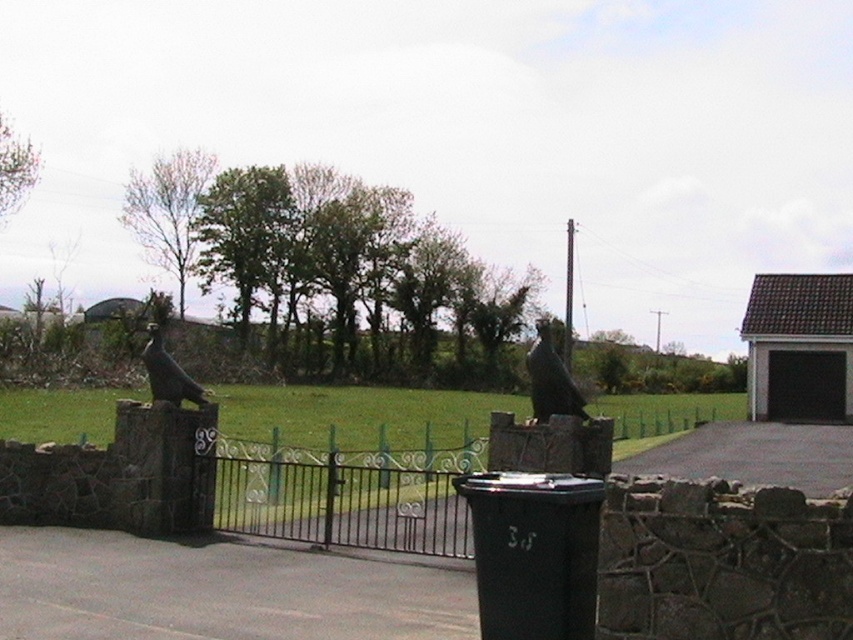
Which is in front, point (538, 413) or point (154, 365)?

Point (538, 413) is in front.

Is polished bronze eagle at center in front of matte black bird at left?

Yes.

Who is more distant from viewer, (529, 422) or (163, 385)?

Positioned behind is point (163, 385).

Locate an element on the screen. The width and height of the screenshot is (853, 640). polished bronze eagle at center is located at coordinates (550, 380).

Does black wrought iron gate at center come behind matte black bird at left?

No, it is in front of matte black bird at left.

Can you confirm if black wrought iron gate at center is smaller than matte black bird at left?

Yes.

Who is more distant from viewer, (x=440, y=550) or (x=170, y=401)?

The point (x=170, y=401) is behind.

Where is `black wrought iron gate at center`? The image size is (853, 640). black wrought iron gate at center is located at coordinates (347, 493).

Does black wrought iron gate at center appear on the right side of polished bronze eagle at center?

No, black wrought iron gate at center is not to the right of polished bronze eagle at center.

Consider the image. Is black wrought iron gate at center closer to the viewer compared to polished bronze eagle at center?

Yes.

Does point (466, 504) come farther from viewer compared to point (575, 410)?

Yes, point (466, 504) is farther from viewer.

The width and height of the screenshot is (853, 640). Identify the location of black wrought iron gate at center. (347, 493).